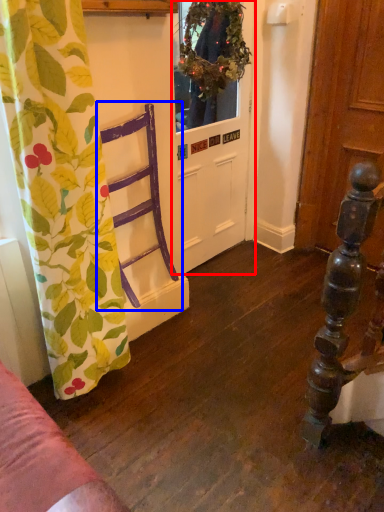
Question: Among these objects, which one is farthest to the camera, door (highlighted by a red box) or armchair (highlighted by a blue box)?

Choices:
 (A) door
 (B) armchair

Answer: (A)